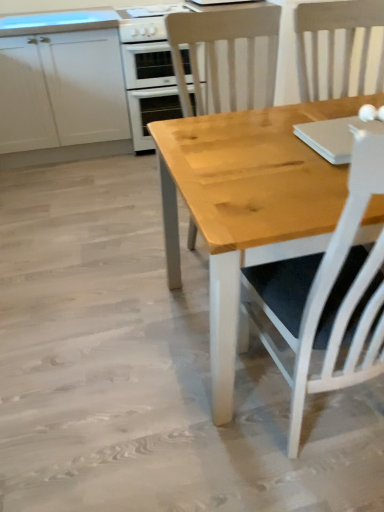
Question: Does white matte cabinet at upper left have a smaller size compared to wooden chair at center?

Choices:
 (A) no
 (B) yes

Answer: (A)

Question: Can you confirm if white matte cabinet at upper left is shorter than wooden chair at center?

Choices:
 (A) no
 (B) yes

Answer: (B)

Question: Is white matte cabinet at upper left in contact with wooden chair at center?

Choices:
 (A) yes
 (B) no

Answer: (B)

Question: Is white matte cabinet at upper left positioned far away from wooden chair at center?

Choices:
 (A) no
 (B) yes

Answer: (A)

Question: From the image's perspective, does white matte cabinet at upper left appear lower than wooden chair at center?

Choices:
 (A) yes
 (B) no

Answer: (B)

Question: Is white glossy oven at upper left inside or outside of white glossy gas stove at upper center?

Choices:
 (A) outside
 (B) inside

Answer: (A)

Question: Is white glossy oven at upper left taller or shorter than white glossy gas stove at upper center?

Choices:
 (A) tall
 (B) short

Answer: (A)

Question: From a real-world perspective, relative to white glossy gas stove at upper center, is white glossy oven at upper left vertically above or below?

Choices:
 (A) above
 (B) below

Answer: (B)

Question: Considering the relative positions of white glossy oven at upper left and white glossy gas stove at upper center in the image provided, is white glossy oven at upper left to the left or to the right of white glossy gas stove at upper center?

Choices:
 (A) left
 (B) right

Answer: (A)

Question: From the image's perspective, relative to white glossy oven at upper left, is wooden chair at center above or below?

Choices:
 (A) above
 (B) below

Answer: (B)

Question: Considering the positions of wooden chair at center and white glossy oven at upper left in the image, is wooden chair at center bigger or smaller than white glossy oven at upper left?

Choices:
 (A) big
 (B) small

Answer: (A)

Question: Is wooden chair at center wider or thinner than white glossy oven at upper left?

Choices:
 (A) thin
 (B) wide

Answer: (A)

Question: Would you say wooden chair at center is inside or outside white glossy oven at upper left?

Choices:
 (A) inside
 (B) outside

Answer: (B)

Question: Considering the positions of white glossy gas stove at upper center and white matte cabinet at upper left in the image, is white glossy gas stove at upper center wider or thinner than white matte cabinet at upper left?

Choices:
 (A) thin
 (B) wide

Answer: (A)

Question: Choose the correct answer: Is white glossy gas stove at upper center inside white matte cabinet at upper left or outside it?

Choices:
 (A) outside
 (B) inside

Answer: (A)